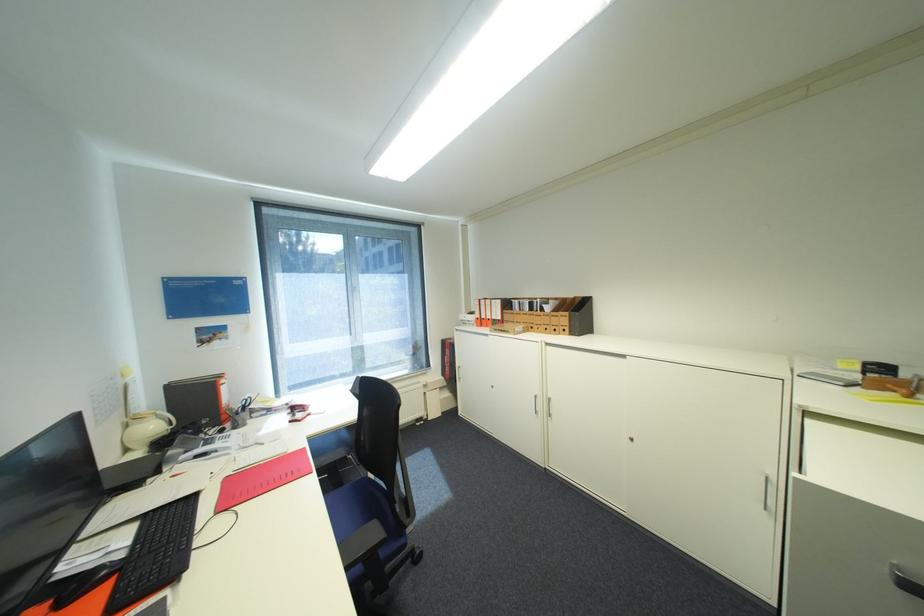
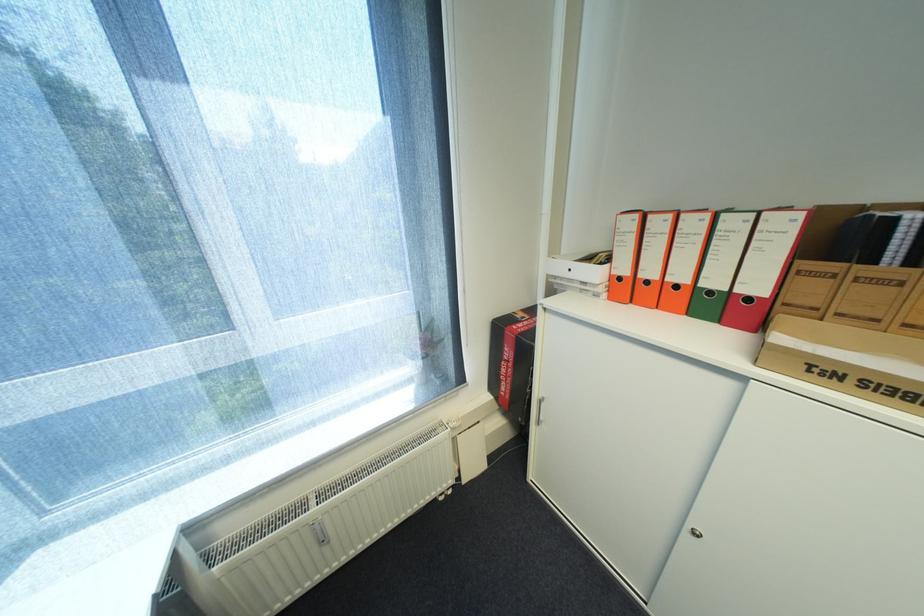
In the second image, find the point that corresponds to (492,320) in the first image.

(655, 283)